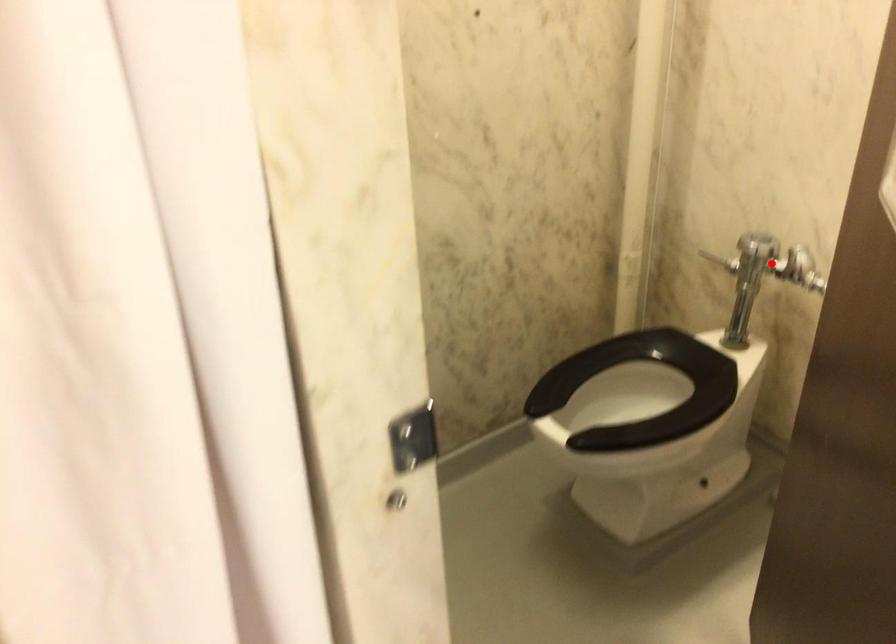
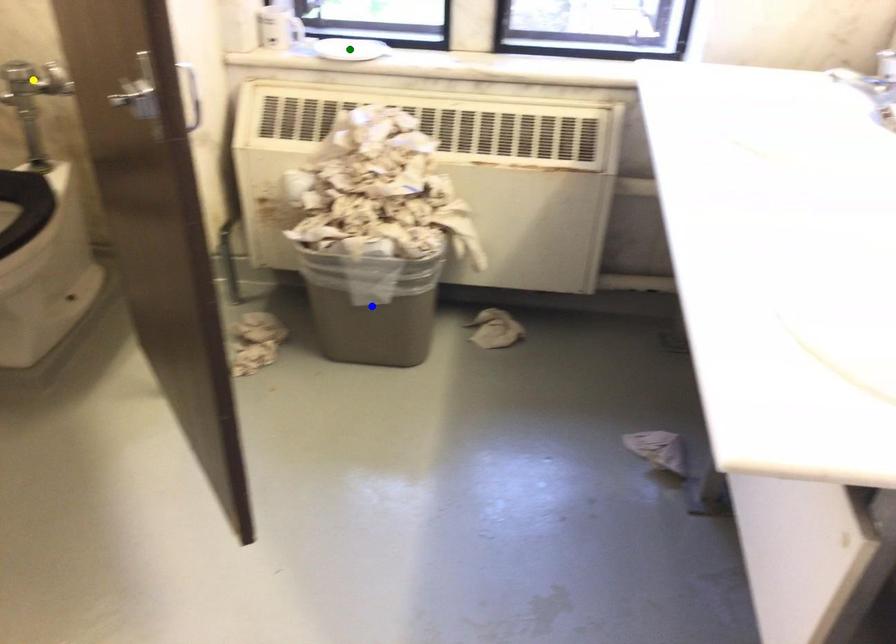
Question: I am providing you with two images of the same scene from different viewpoints. A red point is marked on the first image. You are given multiple points on the second image. In image 2, which mark is for the same physical point as the one in image 1?

Choices:
 (A) yellow point
 (B) blue point
 (C) green point

Answer: (A)